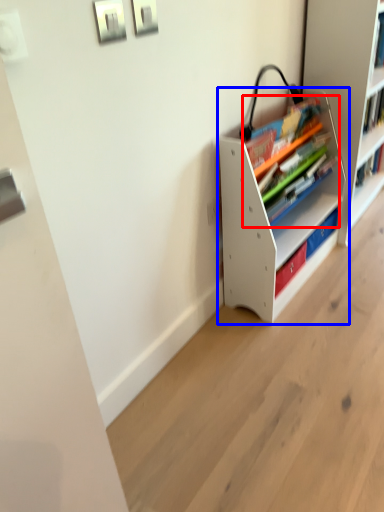
Question: Which of the following is the farthest to the observer, book (highlighted by a red box) or shelf (highlighted by a blue box)?

Choices:
 (A) book
 (B) shelf

Answer: (A)